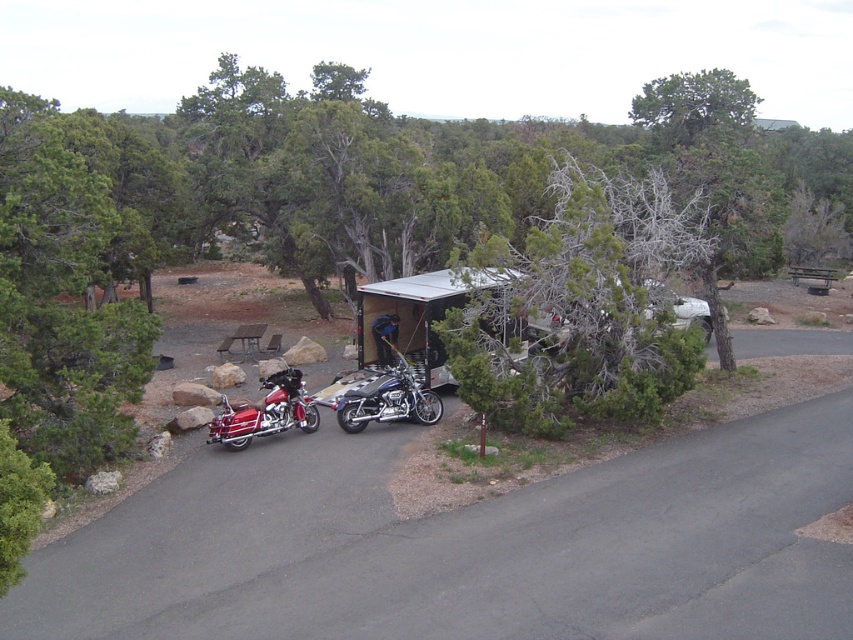
Question: Which point appears closest to the camera in this image?

Choices:
 (A) (576, 291)
 (B) (225, 339)

Answer: (A)

Question: Which point is closer to the camera?

Choices:
 (A) (264, 400)
 (B) (453, 284)

Answer: (B)

Question: From the image, what is the correct spatial relationship of green textured tree at center in relation to shiny blue chrome motorcycle at center?

Choices:
 (A) below
 (B) above

Answer: (B)

Question: Does shiny red motorcycle at center-left appear over shiny blue chrome motorcycle at center?

Choices:
 (A) yes
 (B) no

Answer: (B)

Question: Estimate the real-world distances between objects in this image. Which object is farther from the green textured tree at center?

Choices:
 (A) shiny blue chrome motorcycle at center
 (B) shiny red motorcycle at center-left

Answer: (B)

Question: Is white plastic hut at center above brown wooden picnic table at center?

Choices:
 (A) yes
 (B) no

Answer: (A)